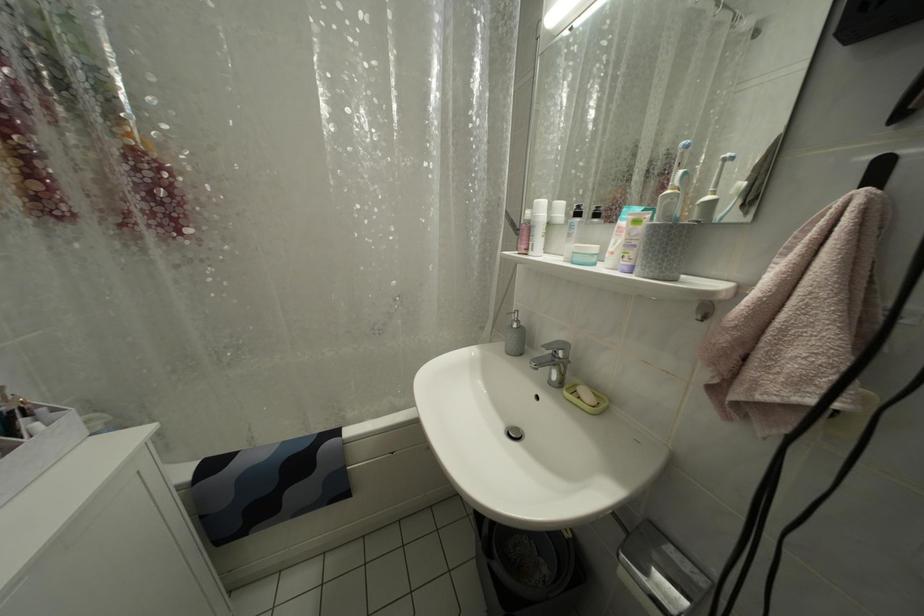
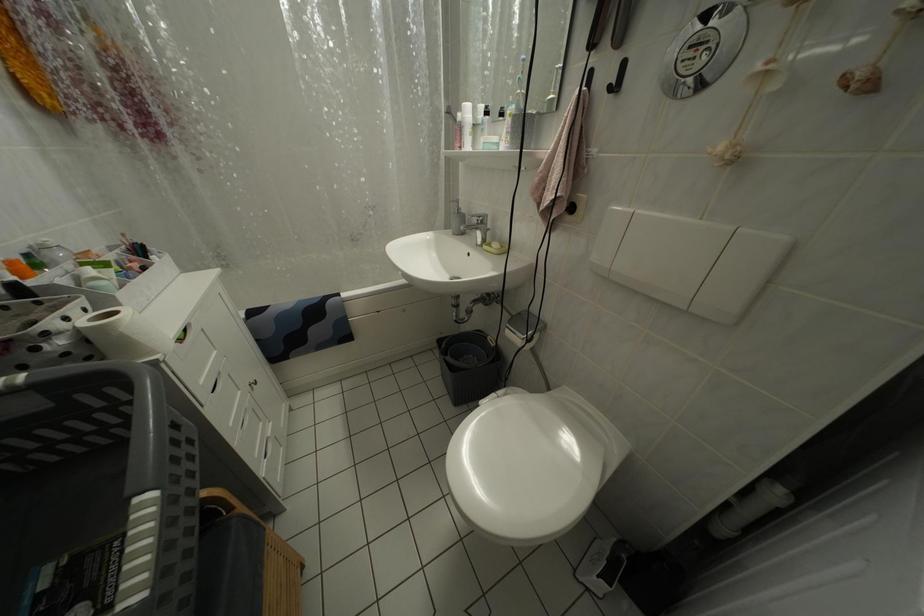
Question: The first image is from the beginning of the video and the second image is from the end. How did the camera likely rotate when shooting the video?

Choices:
 (A) Left
 (B) Right
 (C) Up
 (D) Down

Answer: (D)